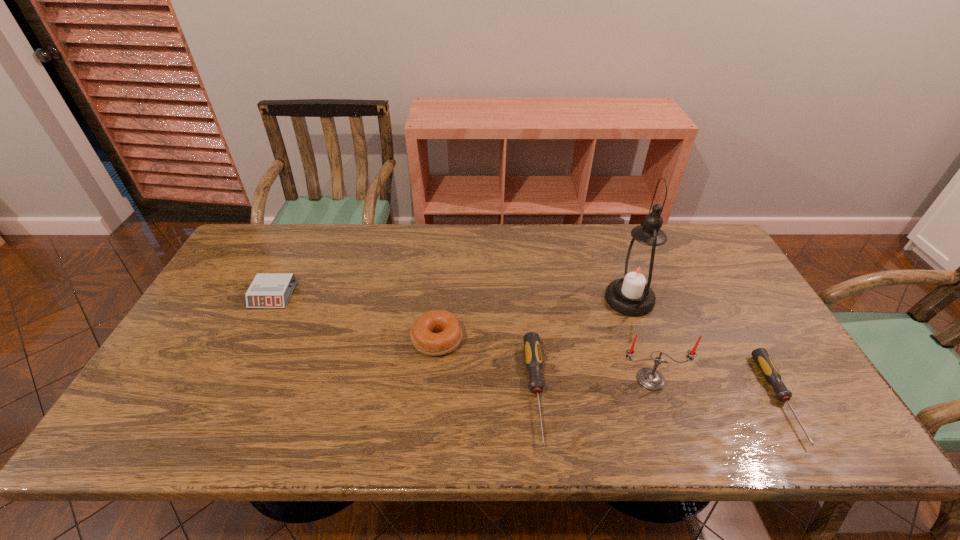
The image size is (960, 540). Identify the location of free point between the bagel and the alarm clock. (355, 318).

The width and height of the screenshot is (960, 540). Identify the location of unoccupied area between the leftmost object and the tallest object. (451, 297).

At what (x,y) coordinates should I click in order to perform the action: click on vacant point located between the tallest object and the second tallest object. Please return your answer as a coordinate pair (x, y). This screenshot has height=540, width=960. Looking at the image, I should click on (640, 339).

Locate an element on the screen. vacant point located between the third tallest object and the oil lamp is located at coordinates (533, 320).

I want to click on unoccupied area between the oil lamp and the leftmost object, so click(451, 297).

The width and height of the screenshot is (960, 540). Find the location of `vacant region between the taller screwdriver and the alarm clock`. vacant region between the taller screwdriver and the alarm clock is located at coordinates (x=404, y=343).

Locate an element on the screen. The width and height of the screenshot is (960, 540). empty location between the fifth shortest object and the left screwdriver is located at coordinates (593, 385).

Locate an element on the screen. The width and height of the screenshot is (960, 540). free space between the second object from left to right and the shorter screwdriver is located at coordinates (609, 369).

Identify the location of unoccupied position between the oil lamp and the candle. (640, 339).

This screenshot has width=960, height=540. I want to click on object that is the fifth nearest to the second object from left to right, so click(770, 372).